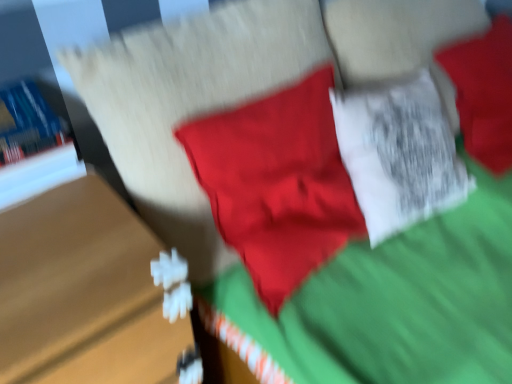
Question: From a real-world perspective, is wooden table at left above or below blue hardcover book at left?

Choices:
 (A) below
 (B) above

Answer: (A)

Question: Considering the positions of wooden table at left and blue hardcover book at left in the image, is wooden table at left taller or shorter than blue hardcover book at left?

Choices:
 (A) short
 (B) tall

Answer: (B)

Question: From the image's perspective, is wooden table at left located above or below blue hardcover book at left?

Choices:
 (A) above
 (B) below

Answer: (B)

Question: Would you say blue hardcover book at left is to the left or to the right of wooden table at left in the picture?

Choices:
 (A) left
 (B) right

Answer: (A)

Question: Is blue hardcover book at left taller or shorter than wooden table at left?

Choices:
 (A) short
 (B) tall

Answer: (A)

Question: Relative to wooden table at left, is blue hardcover book at left in front or behind?

Choices:
 (A) front
 (B) behind

Answer: (B)

Question: Is point (57, 170) positioned closer to the camera than point (126, 243)?

Choices:
 (A) farther
 (B) closer

Answer: (A)